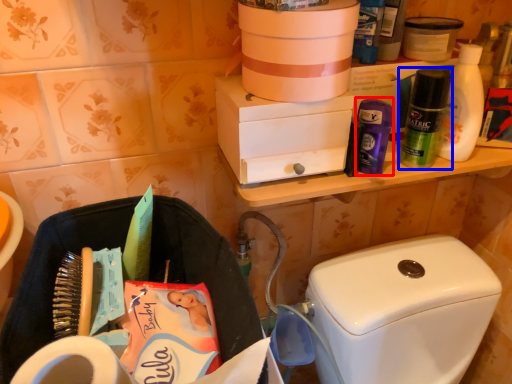
Question: Which object is closer to the camera taking this photo, toiletry (highlighted by a red box) or toiletry (highlighted by a blue box)?

Choices:
 (A) toiletry
 (B) toiletry

Answer: (B)